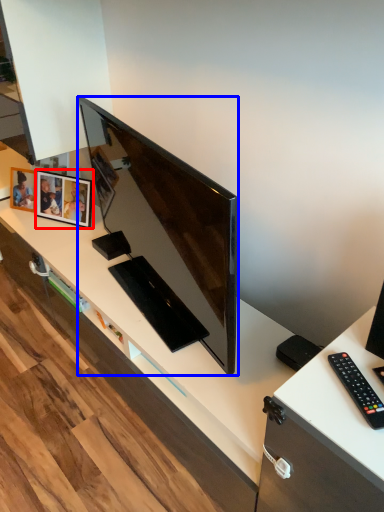
Question: Which object appears farthest to the camera in this image, picture frame (highlighted by a red box) or television (highlighted by a blue box)?

Choices:
 (A) picture frame
 (B) television

Answer: (A)